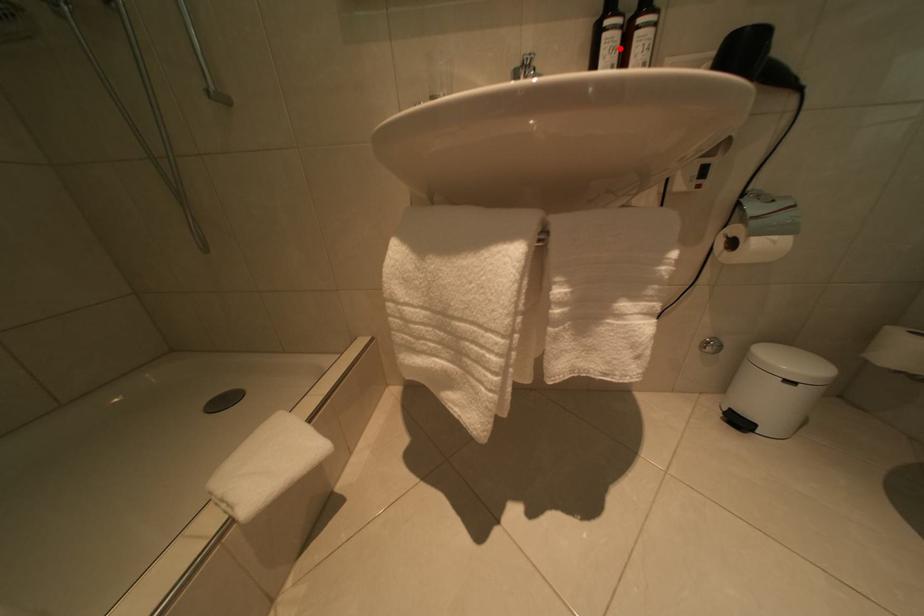
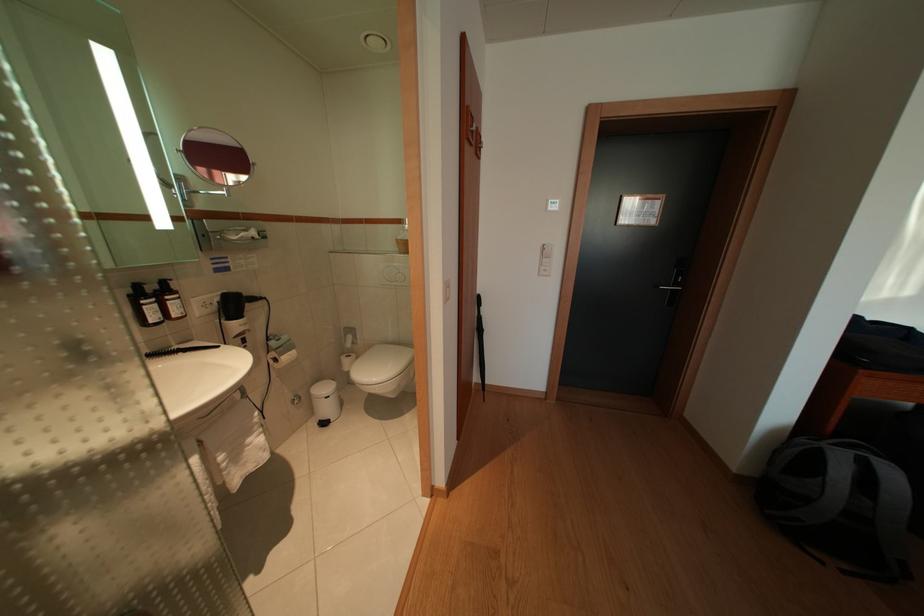
The point at the highlighted location is marked in the first image. Where is the corresponding point in the second image?

(159, 315)